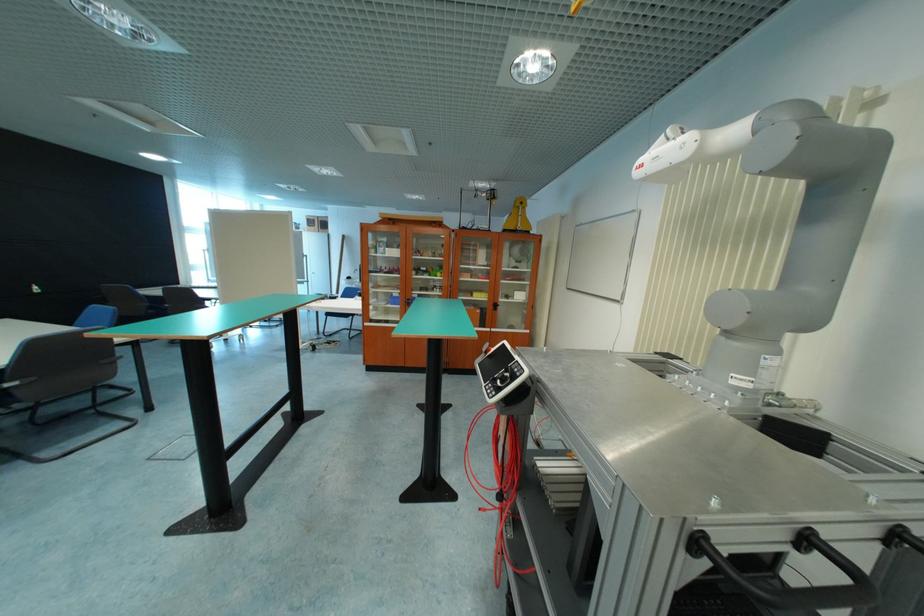
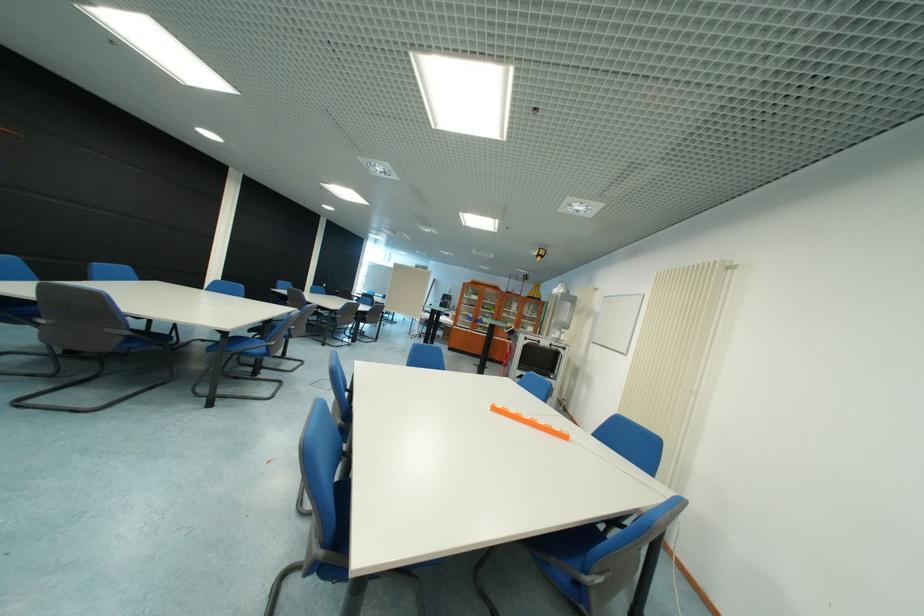
Question: In a continuous first-person perspective shot, in which direction is the camera moving?

Choices:
 (A) Left
 (B) Right
 (C) Forward
 (D) Backward

Answer: (D)